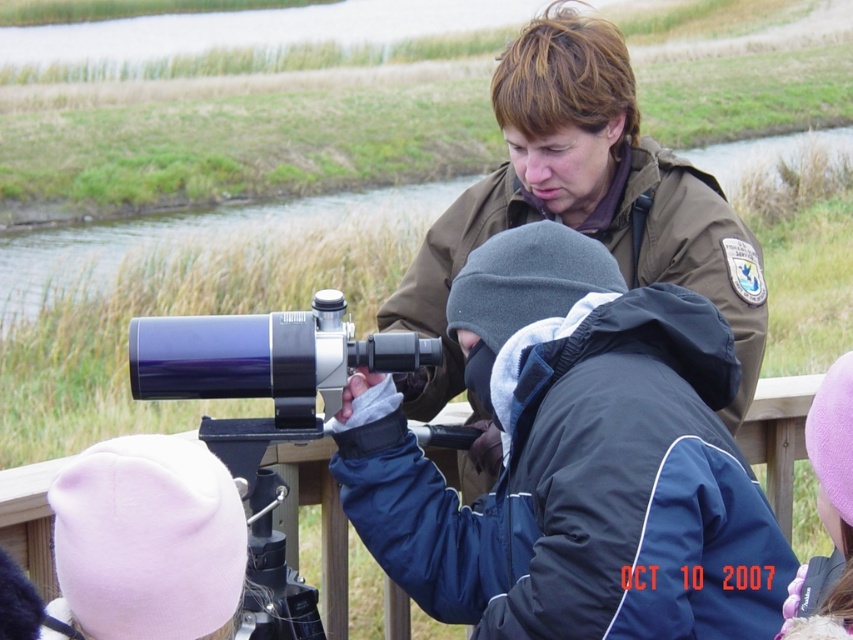
You are a photographer trying to capture a photo of the dark blue fabric jacket at center and the matte black telescope at center. Based on their sizes, which object should you focus on first if you want both to be in clear focus?

The dark blue fabric jacket at center has a larger size compared to the matte black telescope at center. Therefore, you should focus on the larger object first to ensure both are in clear focus.

You are a visitor at this outdoor event and want to take a photo of the purple fleece hat at lower right without blocking the matte black telescope at center. Which side should you stand to take the photo?

The matte black telescope at center is positioned on the left side of the purple fleece hat at lower right, so you should stand to the right side of the purple fleece hat at lower right to avoid blocking the telescope.